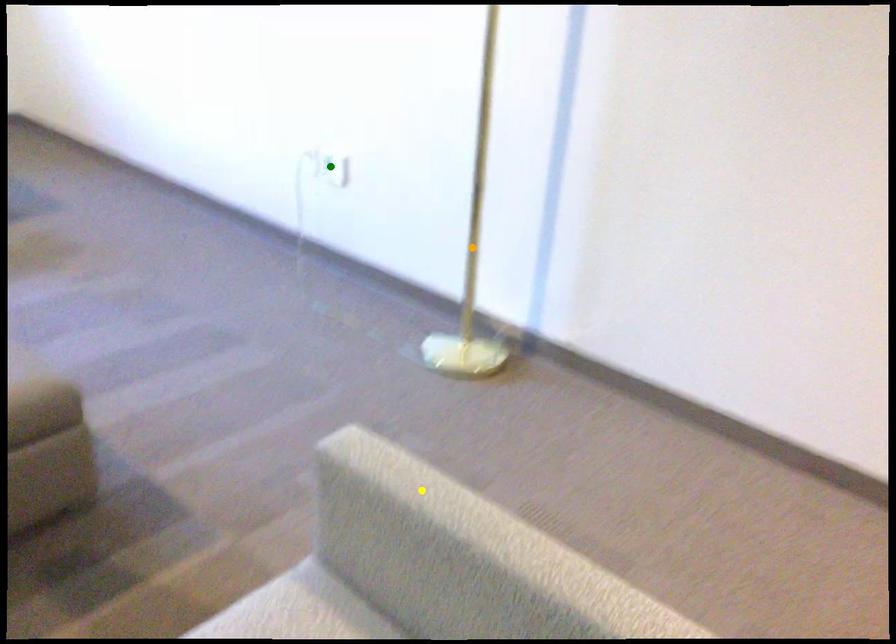
Order these from nearest to farthest:
A) yellow point
B) orange point
C) green point

green point
orange point
yellow point